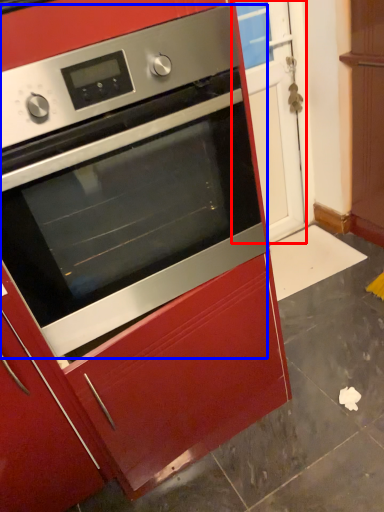
Question: Which object is closer to the camera taking this photo, glass door (highlighted by a red box) or oven (highlighted by a blue box)?

Choices:
 (A) glass door
 (B) oven

Answer: (B)